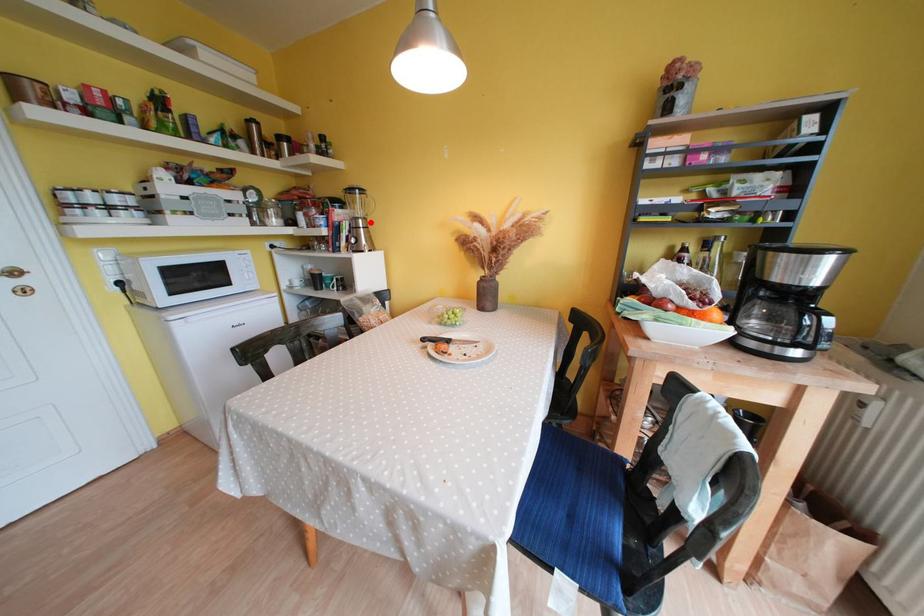
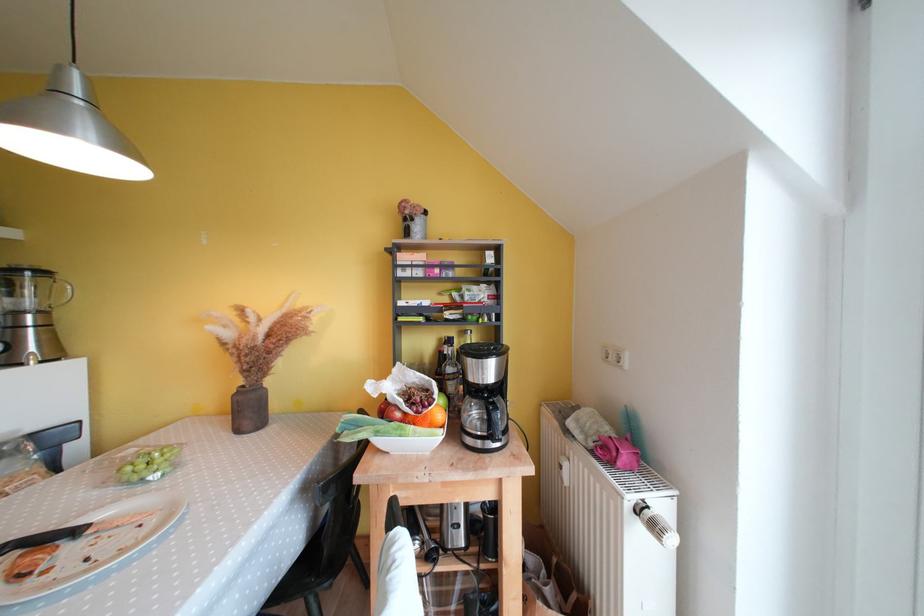
Where in the second image is the point corresponding to the highlighted location from the first image?

(49, 315)